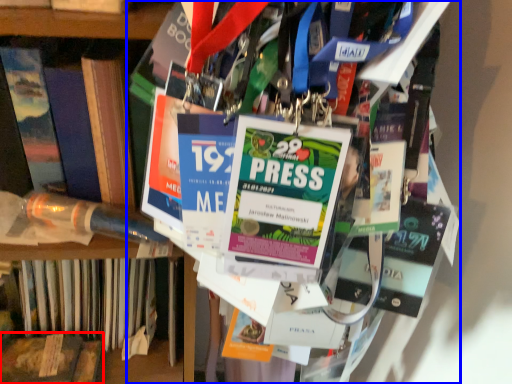
Question: Among these objects, which one is nearest to the camera, book (highlighted by a red box) or book (highlighted by a blue box)?

Choices:
 (A) book
 (B) book

Answer: (B)